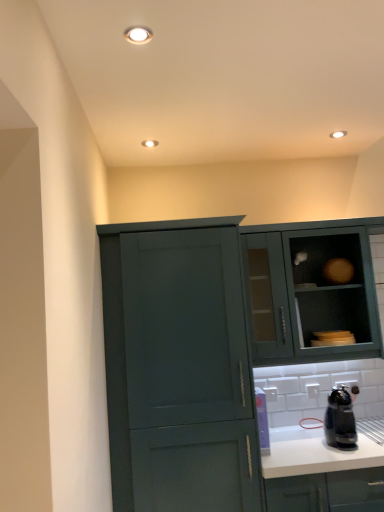
Locate an element on the screen. matte teal cabinet at center-left, which is the second cabinetry from right to left is located at coordinates (215, 346).

This screenshot has height=512, width=384. Describe the element at coordinates (315, 453) in the screenshot. I see `white matte countertop at lower right` at that location.

In order to face white matte countertop at lower right, should I rotate leftwards or rightwards?

Turn right by 19.238 degrees to look at white matte countertop at lower right.

The height and width of the screenshot is (512, 384). Find the location of `matte teal cabinet at center-left, which is the second cabinetry from right to left`. matte teal cabinet at center-left, which is the second cabinetry from right to left is located at coordinates (215, 346).

Is point (300, 451) farther from viewer compared to point (377, 315)?

No, it is in front of (377, 315).

From a real-world perspective, who is located lower, white matte countertop at lower right or matte teal cabinet at upper right, the second cabinetry positioned from the left?

white matte countertop at lower right, from a real-world perspective.

Can you see white matte countertop at lower right touching matte teal cabinet at upper right, arranged as the 1th cabinetry when viewed from the right?

They are not placed beside each other.

Does white matte countertop at lower right have a larger size compared to matte teal cabinet at upper right, the second cabinetry positioned from the left?

Correct, white matte countertop at lower right is larger in size than matte teal cabinet at upper right, the second cabinetry positioned from the left.

Can you confirm if matte teal cabinet at center-left, which is the second cabinetry from right to left, is thinner than black plastic coffee maker at lower right?

No, matte teal cabinet at center-left, which is the second cabinetry from right to left, is not thinner than black plastic coffee maker at lower right.

Which object is positioned more to the left, matte teal cabinet at center-left, which is the second cabinetry from right to left, or black plastic coffee maker at lower right?

Positioned to the left is matte teal cabinet at center-left, which is the second cabinetry from right to left.

Is point (271, 285) closer to camera compared to point (342, 395)?

No, it is not.

Is matte teal cabinet at center-left, arranged as the 1th cabinetry when viewed from the left, spatially inside black plastic coffee maker at lower right, or outside of it?

matte teal cabinet at center-left, arranged as the 1th cabinetry when viewed from the left, is located beyond the bounds of black plastic coffee maker at lower right.

Does point (336, 430) appear closer or farther from the camera than point (355, 315)?

Point (336, 430) is closer to the camera than point (355, 315).

Considering the relative positions of black plastic coffee maker at lower right and matte teal cabinet at upper right, the second cabinetry positioned from the left, in the image provided, is black plastic coffee maker at lower right in front of matte teal cabinet at upper right, the second cabinetry positioned from the left,?

Yes, it is in front of matte teal cabinet at upper right, the second cabinetry positioned from the left.

How many degrees apart are the facing directions of black plastic coffee maker at lower right and matte teal cabinet at upper right, the second cabinetry positioned from the left?

4.86 degrees.

Is black plastic coffee maker at lower right far from matte teal cabinet at upper right, the second cabinetry positioned from the left?

No, black plastic coffee maker at lower right is not far from matte teal cabinet at upper right, the second cabinetry positioned from the left.

Do you think matte teal cabinet at center-left, which is the second cabinetry from right to left, is within matte teal cabinet at upper right, arranged as the 1th cabinetry when viewed from the right, or outside of it?

matte teal cabinet at center-left, which is the second cabinetry from right to left, is outside matte teal cabinet at upper right, arranged as the 1th cabinetry when viewed from the right.

Is matte teal cabinet at center-left, which is the second cabinetry from right to left, turned away from matte teal cabinet at upper right, arranged as the 1th cabinetry when viewed from the right?

matte teal cabinet at center-left, which is the second cabinetry from right to left, is not turned away from matte teal cabinet at upper right, arranged as the 1th cabinetry when viewed from the right.

You are a GUI agent. You are given a task and a screenshot of the screen. Output one action in this format:
    pyautogui.click(x=<x>, y=<y>)
    Task: Click on the cabinetry above the matte teal cabinet at center-left, arranged as the 1th cabinetry when viewed from the left (from a real-world perspective)
    Image resolution: width=384 pixels, height=512 pixels.
    Given the screenshot: What is the action you would take?
    pyautogui.click(x=309, y=290)

Who is shorter, matte teal cabinet at center-left, which is the second cabinetry from right to left, or white matte countertop at lower right?

Standing shorter between the two is white matte countertop at lower right.

From the image's perspective, between matte teal cabinet at center-left, which is the second cabinetry from right to left, and white matte countertop at lower right, who is located below?

white matte countertop at lower right, from the image's perspective.

Is matte teal cabinet at center-left, which is the second cabinetry from right to left, at the right side of white matte countertop at lower right?

No.

Which is closer, (212, 354) or (265, 470)?

The point (265, 470) is more forward.

This screenshot has width=384, height=512. There is a white matte countertop at lower right. Find the location of `kitchen appliance above it (from a real-world perspective)`. kitchen appliance above it (from a real-world perspective) is located at coordinates pyautogui.click(x=340, y=419).

Considering the sizes of objects black plastic coffee maker at lower right and white matte countertop at lower right in the image provided, who is smaller, black plastic coffee maker at lower right or white matte countertop at lower right?

black plastic coffee maker at lower right is smaller.

Is point (336, 426) less distant than point (328, 451)?

No.

Based on their positions, is black plastic coffee maker at lower right located to the left or right of white matte countertop at lower right?

From the image, it's evident that black plastic coffee maker at lower right is to the right of white matte countertop at lower right.

Considering the relative sizes of matte teal cabinet at upper right, arranged as the 1th cabinetry when viewed from the right, and black plastic coffee maker at lower right in the image provided, is matte teal cabinet at upper right, arranged as the 1th cabinetry when viewed from the right, smaller than black plastic coffee maker at lower right?

No.

The height and width of the screenshot is (512, 384). I want to click on kitchen appliance located on the right of matte teal cabinet at upper right, the second cabinetry positioned from the left, so click(340, 419).

From a real-world perspective, which object rests below the other?

In real-world perspective, black plastic coffee maker at lower right is lower.

The height and width of the screenshot is (512, 384). I want to click on cabinetry that is the 2nd one when counting upward from the white matte countertop at lower right (from the image's perspective), so click(x=309, y=290).

You are a GUI agent. You are given a task and a screenshot of the screen. Output one action in this format:
    pyautogui.click(x=<x>, y=<y>)
    Task: Click on the cabinetry in front of the black plastic coffee maker at lower right
    The height and width of the screenshot is (512, 384).
    Given the screenshot: What is the action you would take?
    pyautogui.click(x=215, y=346)

Which object lies nearer to the anchor point black plastic coffee maker at lower right, matte teal cabinet at upper right, arranged as the 1th cabinetry when viewed from the right, or white matte countertop at lower right?

white matte countertop at lower right is closer to black plastic coffee maker at lower right.

From the image, which object appears to be farther from matte teal cabinet at upper right, the second cabinetry positioned from the left, white matte countertop at lower right or matte teal cabinet at center-left, arranged as the 1th cabinetry when viewed from the left?

white matte countertop at lower right is further to matte teal cabinet at upper right, the second cabinetry positioned from the left.

Looking at this image, which object lies further to the anchor point black plastic coffee maker at lower right, white matte countertop at lower right or matte teal cabinet at center-left, which is the second cabinetry from right to left?

matte teal cabinet at center-left, which is the second cabinetry from right to left, lies further to black plastic coffee maker at lower right than the other object.

Considering their positions, is matte teal cabinet at center-left, which is the second cabinetry from right to left, positioned closer to matte teal cabinet at upper right, the second cabinetry positioned from the left, than black plastic coffee maker at lower right?

black plastic coffee maker at lower right lies closer to matte teal cabinet at upper right, the second cabinetry positioned from the left, than the other object.

When comparing their distances from matte teal cabinet at center-left, which is the second cabinetry from right to left, does matte teal cabinet at upper right, arranged as the 1th cabinetry when viewed from the right, or black plastic coffee maker at lower right seem further?

black plastic coffee maker at lower right is positioned further to the anchor matte teal cabinet at center-left, which is the second cabinetry from right to left.

In the scene shown: Based on their spatial positions, is black plastic coffee maker at lower right or matte teal cabinet at center-left, which is the second cabinetry from right to left, closer to white matte countertop at lower right?

black plastic coffee maker at lower right is positioned closer to the anchor white matte countertop at lower right.

From the image, which object appears to be nearer to matte teal cabinet at center-left, arranged as the 1th cabinetry when viewed from the left, black plastic coffee maker at lower right or matte teal cabinet at upper right, the second cabinetry positioned from the left?

matte teal cabinet at upper right, the second cabinetry positioned from the left, is positioned closer to the anchor matte teal cabinet at center-left, arranged as the 1th cabinetry when viewed from the left.

From the image, which object appears to be farther from matte teal cabinet at center-left, which is the second cabinetry from right to left, black plastic coffee maker at lower right or white matte countertop at lower right?

black plastic coffee maker at lower right is further to matte teal cabinet at center-left, which is the second cabinetry from right to left.

You are a GUI agent. You are given a task and a screenshot of the screen. Output one action in this format:
    pyautogui.click(x=<x>, y=<y>)
    Task: Click on the kitchen appliance between matte teal cabinet at upper right, arranged as the 1th cabinetry when viewed from the right, and white matte countertop at lower right from top to bottom
    
    Given the screenshot: What is the action you would take?
    pyautogui.click(x=340, y=419)

This screenshot has width=384, height=512. I want to click on countertop located between matte teal cabinet at center-left, arranged as the 1th cabinetry when viewed from the left, and black plastic coffee maker at lower right in the left-right direction, so click(315, 453).

Find the location of a particular element. The width and height of the screenshot is (384, 512). cabinetry between matte teal cabinet at upper right, arranged as the 1th cabinetry when viewed from the right, and white matte countertop at lower right, in the vertical direction is located at coordinates (215, 346).

Where is `cabinetry between matte teal cabinet at center-left, arranged as the 1th cabinetry when viewed from the left, and black plastic coffee maker at lower right, in the horizontal direction`? The width and height of the screenshot is (384, 512). cabinetry between matte teal cabinet at center-left, arranged as the 1th cabinetry when viewed from the left, and black plastic coffee maker at lower right, in the horizontal direction is located at coordinates (309, 290).